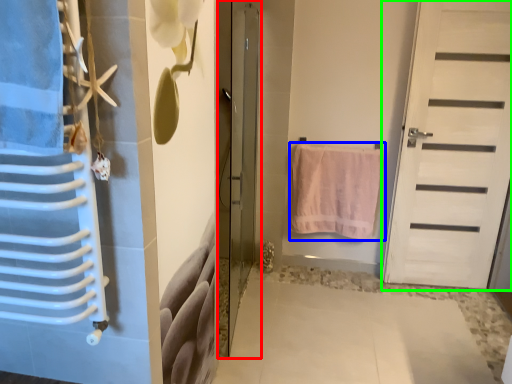
Question: Which object is positioned farthest from door (highlighted by a red box)? Select from towel (highlighted by a blue box) and door (highlighted by a green box).

Choices:
 (A) towel
 (B) door

Answer: (B)